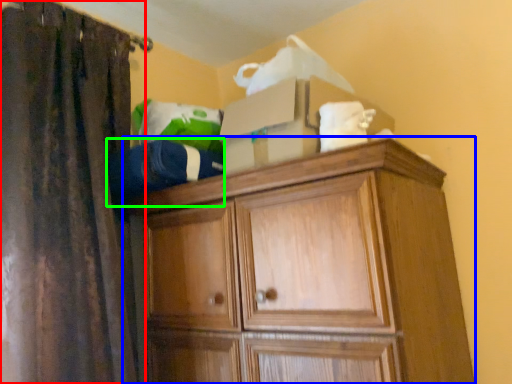
Question: Considering the real-world distances, which object is closest to curtain (highlighted by a red box)? cupboard (highlighted by a blue box) or clothing (highlighted by a green box).

Choices:
 (A) cupboard
 (B) clothing

Answer: (B)